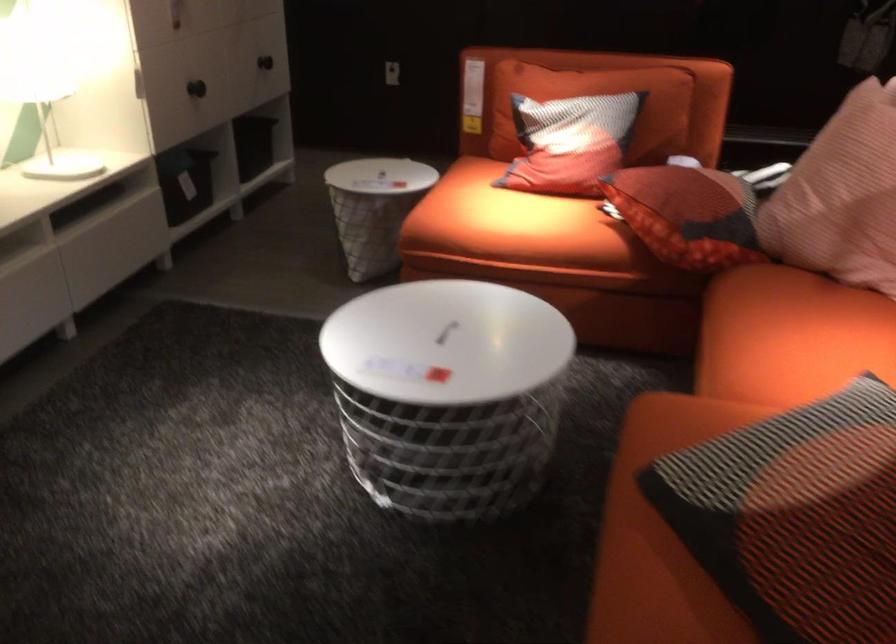
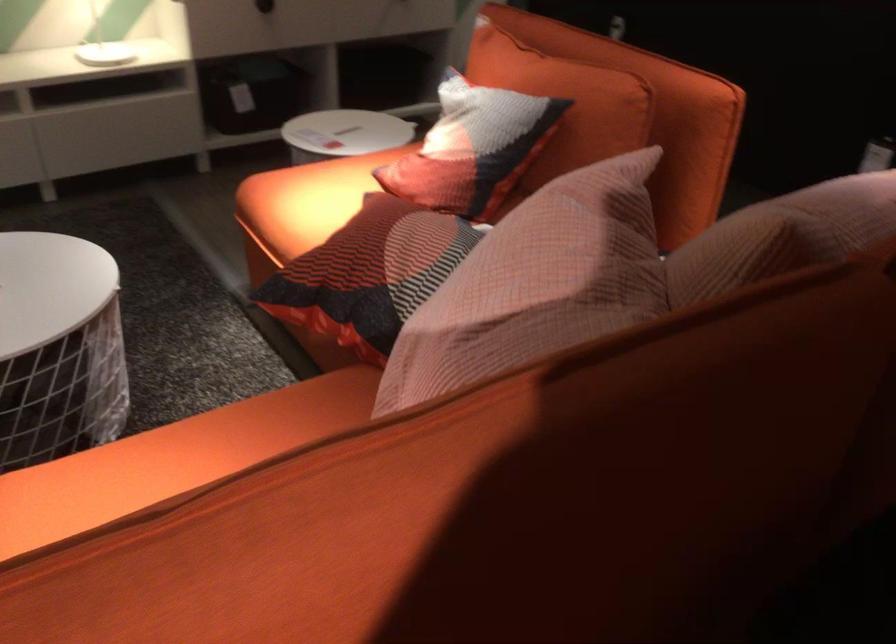
In the second image, find the point that corresponds to [609,133] in the first image.

(472, 147)